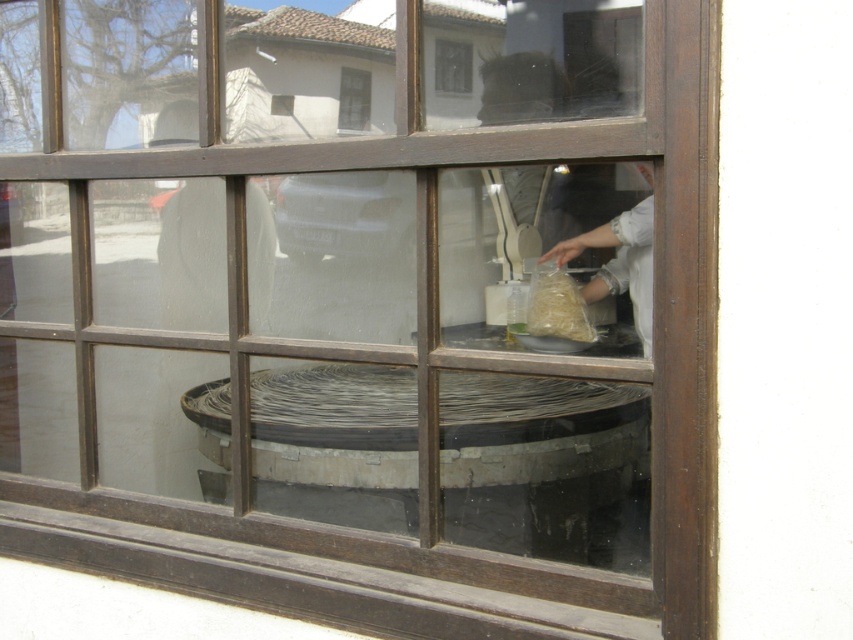
Does point (561, 289) come behind point (445, 42)?

That is True.

Who is taller, translucent paper bag at center or transparent glass at center?

translucent paper bag at center is taller.

Where is `translucent paper bag at center`? The image size is (853, 640). translucent paper bag at center is located at coordinates tap(556, 305).

Describe the element at coordinates (619, 262) in the screenshot. This screenshot has height=640, width=853. I see `white fabric at center` at that location.

Is white fabric at center bigger than transparent glass at center?

Yes, white fabric at center is bigger than transparent glass at center.

Who is more forward, (x=646, y=330) or (x=444, y=84)?

Point (x=444, y=84) is in front.

You are a GUI agent. You are given a task and a screenshot of the screen. Output one action in this format:
    pyautogui.click(x=<x>, y=<y>)
    Task: Click on the white fabric at center
    
    Given the screenshot: What is the action you would take?
    pyautogui.click(x=619, y=262)

Can you confirm if white fabric at center is thinner than transparent glass window at center?

Incorrect, white fabric at center's width is not less than transparent glass window at center's.

Who is more forward, (648, 332) or (364, 86)?

Point (364, 86)

Is point (579, 250) closer to viewer compared to point (341, 86)?

No, (579, 250) is further to viewer.

Where is `white fabric at center`? The image size is (853, 640). white fabric at center is located at coordinates (619, 262).